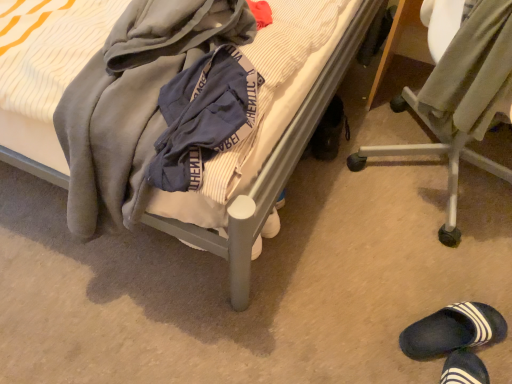
Question: Is dark blue rubber slipper at lower right, the 2th footwear positioned from the back, positioned in front of black rubber shoe at lower right, which appears as the 1th footwear when viewed from the back?

Choices:
 (A) yes
 (B) no

Answer: (A)

Question: Can you confirm if dark blue rubber slipper at lower right, which appears as the 1th footwear when viewed from the front, is positioned to the right of black rubber shoe at lower right, positioned as the second footwear in right-to-left order?

Choices:
 (A) no
 (B) yes

Answer: (B)

Question: Is dark blue rubber slipper at lower right, which appears as the 1th footwear when viewed from the front, wider than black rubber shoe at lower right, which is counted as the 2th footwear, starting from the bottom?

Choices:
 (A) no
 (B) yes

Answer: (A)

Question: Is dark blue rubber slipper at lower right, which appears as the 1th footwear when viewed from the front, outside black rubber shoe at lower right, which appears as the 1th footwear when viewed from the back?

Choices:
 (A) no
 (B) yes

Answer: (B)

Question: Can you confirm if dark blue rubber slipper at lower right, which appears as the 1th footwear when viewed from the front, is taller than black rubber shoe at lower right, which appears as the 1th footwear when viewed from the back?

Choices:
 (A) no
 (B) yes

Answer: (A)

Question: Does point (492, 69) appear closer or farther from the camera than point (331, 107)?

Choices:
 (A) farther
 (B) closer

Answer: (B)

Question: Based on their sizes in the image, would you say metallic silver chair at lower right is bigger or smaller than black rubber shoe at lower right, the 1th footwear from the top?

Choices:
 (A) small
 (B) big

Answer: (B)

Question: Would you say metallic silver chair at lower right is to the left or to the right of black rubber shoe at lower right, which appears as the 1th footwear when viewed from the back, in the picture?

Choices:
 (A) left
 (B) right

Answer: (B)

Question: Considering the positions of metallic silver chair at lower right and black rubber shoe at lower right, acting as the 2th footwear starting from the front, in the image, is metallic silver chair at lower right taller or shorter than black rubber shoe at lower right, acting as the 2th footwear starting from the front,?

Choices:
 (A) short
 (B) tall

Answer: (B)

Question: Is point (96, 61) positioned closer to the camera than point (207, 236)?

Choices:
 (A) closer
 (B) farther

Answer: (A)

Question: From the image's perspective, is soft gray hoodie at center, the 2th clothing viewed from the right, located above or below soft gray blanket at center?

Choices:
 (A) above
 (B) below

Answer: (B)

Question: From their relative heights in the image, would you say soft gray hoodie at center, acting as the first clothing starting from the left, is taller or shorter than soft gray blanket at center?

Choices:
 (A) short
 (B) tall

Answer: (A)

Question: Relative to soft gray blanket at center, is soft gray hoodie at center, the 2th clothing viewed from the right, in front or behind?

Choices:
 (A) front
 (B) behind

Answer: (B)

Question: Visually, is soft gray blanket at center positioned to the left or to the right of soft gray hoodie at center, the 2th clothing viewed from the right?

Choices:
 (A) left
 (B) right

Answer: (A)

Question: Relative to soft gray hoodie at center, acting as the first clothing starting from the left, is soft gray blanket at center in front or behind?

Choices:
 (A) front
 (B) behind

Answer: (A)